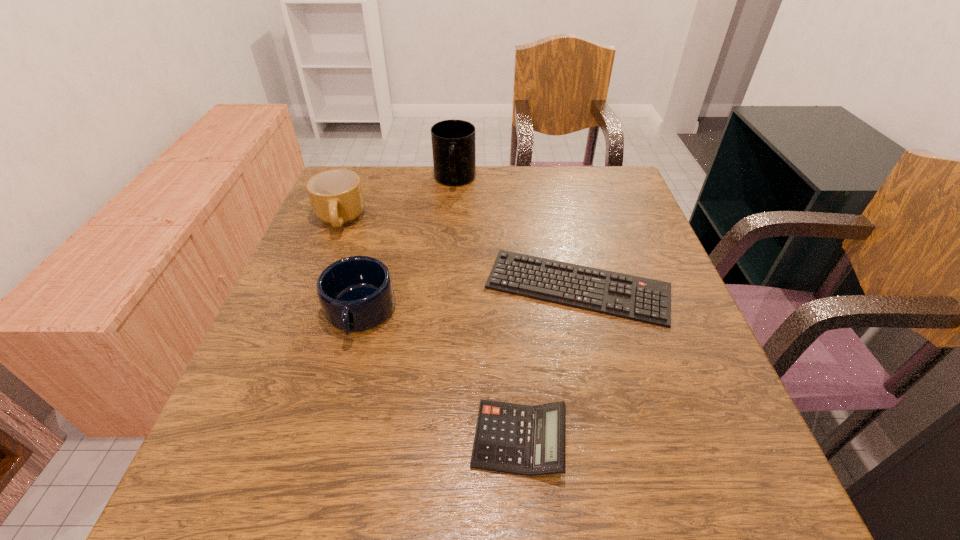
This screenshot has height=540, width=960. I want to click on vacant space located 0.290m on the right of the calculator, so click(747, 439).

The image size is (960, 540). What are the coordinates of `vacant area located on the back of the shortest object` in the screenshot? It's located at (559, 208).

This screenshot has width=960, height=540. Find the location of `object at the near edge`. object at the near edge is located at coordinates (527, 440).

Locate an element on the screen. The width and height of the screenshot is (960, 540). object that is at the right edge is located at coordinates (641, 299).

At what (x,y) coordinates should I click in order to perform the action: click on object that is at the far left corner. Please return your answer as a coordinate pair (x, y). The height and width of the screenshot is (540, 960). Looking at the image, I should click on (336, 196).

At what (x,y) coordinates should I click in order to perform the action: click on vacant space at the far edge of the desktop. Please return your answer as a coordinate pair (x, y). This screenshot has width=960, height=540. Looking at the image, I should click on (419, 169).

Identify the location of vacant region at the near edge of the desktop. (492, 508).

Where is `free space at the left edge of the desktop`? This screenshot has width=960, height=540. free space at the left edge of the desktop is located at coordinates (273, 397).

Image resolution: width=960 pixels, height=540 pixels. In order to click on vacant space at the right edge of the desktop in this screenshot , I will do `click(659, 350)`.

What are the coordinates of `free spot at the far right corner of the desktop` in the screenshot? It's located at (637, 201).